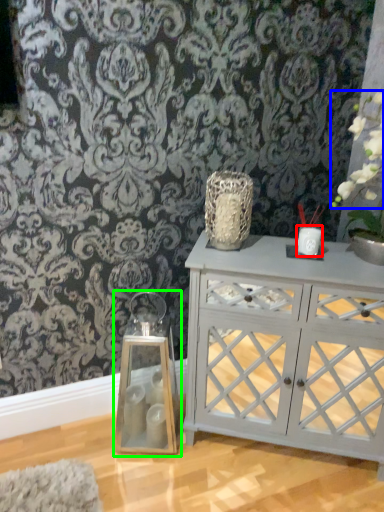
Question: Considering the real-world distances, which object is farthest from candle holder (highlighted by a red box)? floral arrangement (highlighted by a blue box) or candle holder (highlighted by a green box)?

Choices:
 (A) floral arrangement
 (B) candle holder

Answer: (B)